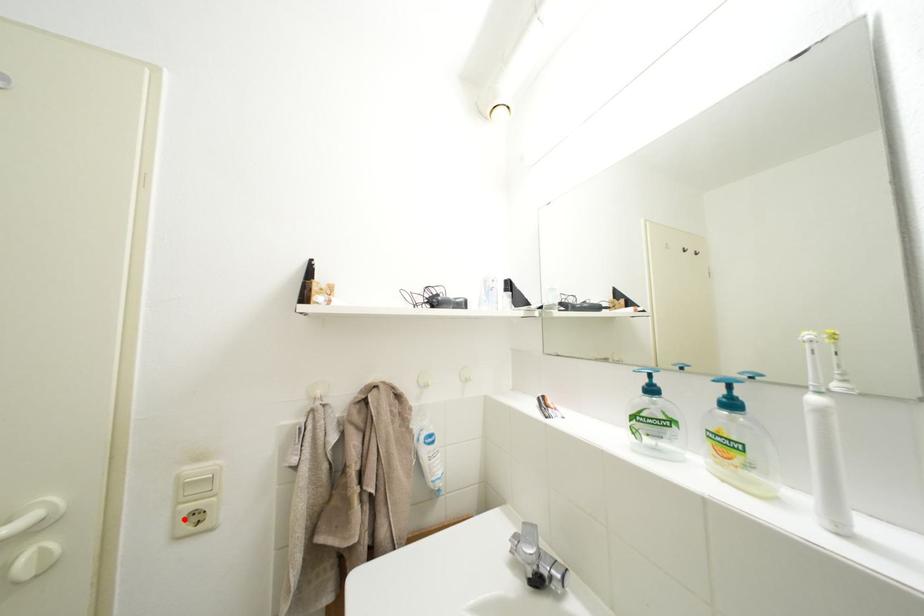
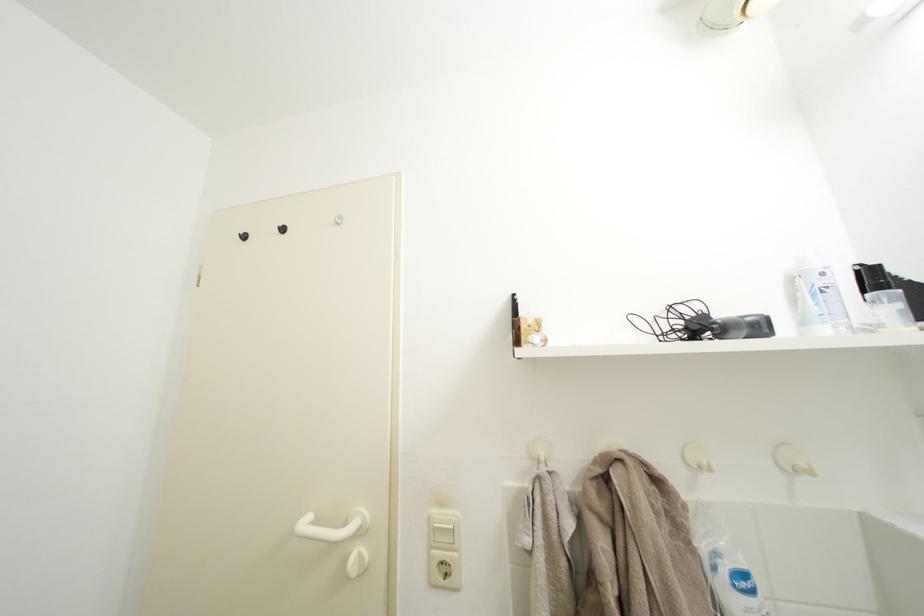
In the second image, find the point that corresponds to the highlighted location in the first image.

(439, 562)